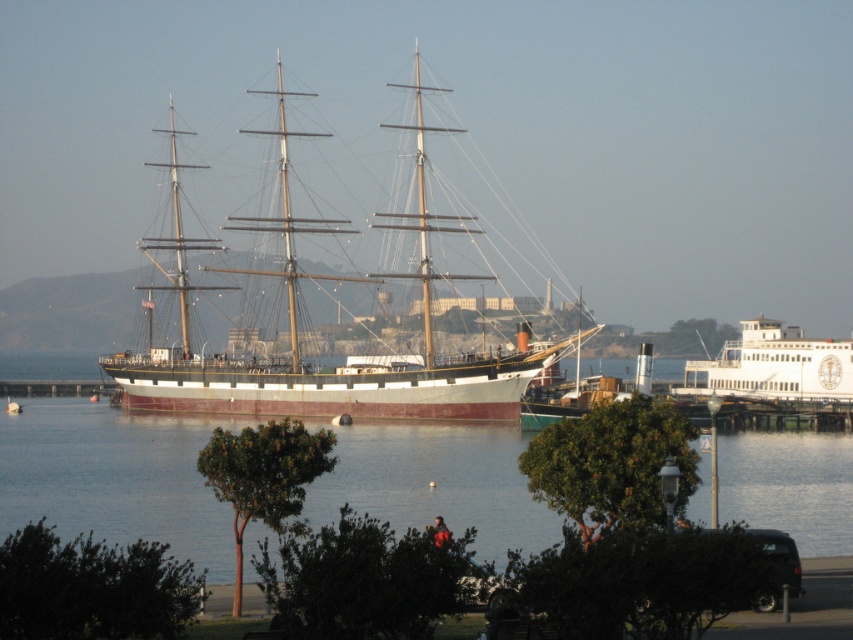
Between point (482, 534) and point (738, 388), which one is positioned in front?

Point (482, 534) is more forward.

Which is more to the right, clear water at center or white glossy ferry at right?

white glossy ferry at right is more to the right.

Which is behind, point (515, 508) or point (770, 346)?

Positioned behind is point (770, 346).

Image resolution: width=853 pixels, height=640 pixels. Identify the location of clear water at center. (113, 477).

Who is lower down, clear water at center or rusty metal sailboat at center?

Positioned lower is clear water at center.

Between point (740, 435) and point (335, 388), which one is positioned behind?

The point (335, 388) is behind.

The height and width of the screenshot is (640, 853). I want to click on clear water at center, so click(113, 477).

Which is above, rusty metal sailboat at center or white glossy ferry at right?

rusty metal sailboat at center is higher up.

Can you confirm if rusty metal sailboat at center is wider than white glossy ferry at right?

Correct, the width of rusty metal sailboat at center exceeds that of white glossy ferry at right.

Locate an element on the screen. The width and height of the screenshot is (853, 640). rusty metal sailboat at center is located at coordinates (347, 364).